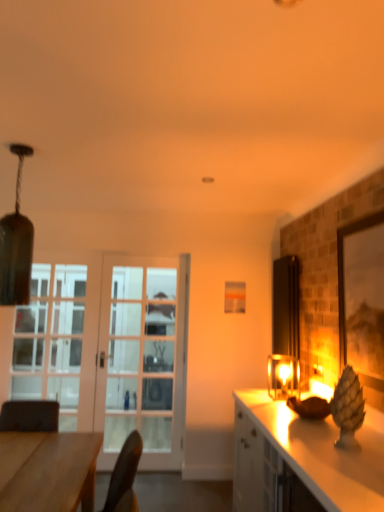
Question: Which is correct: wooden desk at lower left is inside white glossy cabinet at right, or outside of it?

Choices:
 (A) inside
 (B) outside

Answer: (B)

Question: In terms of height, does wooden desk at lower left look taller or shorter compared to white glossy cabinet at right?

Choices:
 (A) short
 (B) tall

Answer: (A)

Question: Estimate the real-world distances between objects in this image. Which object is farther from the white glass door at left?

Choices:
 (A) clear glass door at left
 (B) wooden desk at lower left
 (C) white glossy cabinet at right
 (D) matte glass lampshade at upper left
 (E) matte glass lampshade at right

Answer: (D)

Question: Considering the real-world distances, which object is closest to the wooden desk at lower left?

Choices:
 (A) matte glass lampshade at right
 (B) white glossy cabinet at right
 (C) clear glass door at left
 (D) matte glass lampshade at upper left
 (E) matte wooden picture frame at right

Answer: (D)